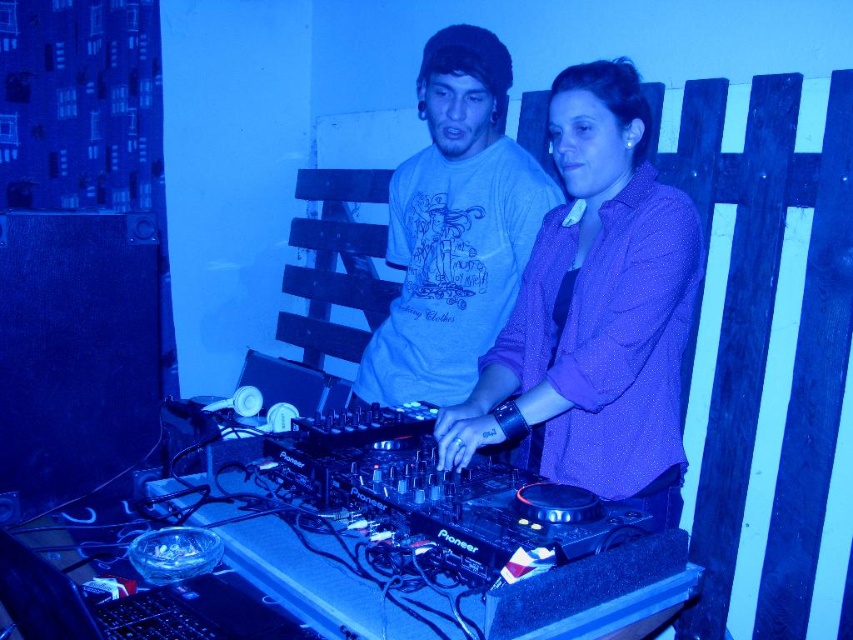
Question: Which object is closer to the camera taking this photo?

Choices:
 (A) matte blue t-shirt at center
 (B) purple dotted shirt at center

Answer: (B)

Question: Can you confirm if purple dotted shirt at center is positioned below matte blue t-shirt at center?

Choices:
 (A) no
 (B) yes

Answer: (B)

Question: Is purple dotted shirt at center above matte blue t-shirt at center?

Choices:
 (A) no
 (B) yes

Answer: (A)

Question: Which point is closer to the camera?

Choices:
 (A) purple dotted shirt at center
 (B) matte blue t-shirt at center

Answer: (A)

Question: Which point appears closest to the camera in this image?

Choices:
 (A) (466, 369)
 (B) (581, 177)

Answer: (B)

Question: Is purple dotted shirt at center thinner than matte blue t-shirt at center?

Choices:
 (A) yes
 (B) no

Answer: (A)